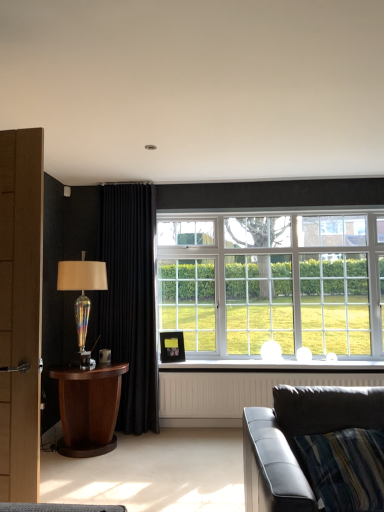
Identify the location of iridescent glass table lamp at left. (82, 298).

You are a GUI agent. You are given a task and a screenshot of the screen. Output one action in this format:
    pyautogui.click(x=<x>, y=<y>)
    Task: Click on the wooden table at left
    This screenshot has height=512, width=384.
    Given the screenshot: What is the action you would take?
    pyautogui.click(x=88, y=408)

From the picture: Measure the distance between wooden table at left and camera.

The distance of wooden table at left from camera is 10.58 feet.

The image size is (384, 512). What do you see at coordinates (130, 298) in the screenshot?
I see `black velvet curtain at left` at bounding box center [130, 298].

This screenshot has width=384, height=512. Identify the location of black velvet curtain at left. (130, 298).

Where is `white glass window at center`? white glass window at center is located at coordinates (273, 283).

Where is `white glossy window sill at lower center`? The image size is (384, 512). white glossy window sill at lower center is located at coordinates (277, 366).

From the image's perspective, is white textured radiator at lower center located above or below wooden table at left?

From the image's perspective, white textured radiator at lower center appears below wooden table at left.

From a real-world perspective, does white textured radiator at lower center sit lower than wooden table at left?

Correct, in the physical world, white textured radiator at lower center is lower than wooden table at left.

Could you tell me if wooden table at left is turned towards white textured radiator at lower center?

Yes, wooden table at left faces towards white textured radiator at lower center.

This screenshot has width=384, height=512. I want to click on radiator located on the right of wooden table at left, so 236,391.

Is wooden table at left further to the viewer compared to white textured radiator at lower center?

That is False.

In the scene shown: Which of these two, wooden table at left or white textured radiator at lower center, stands shorter?

With less height is white textured radiator at lower center.

Between black velvet curtain at left and iridescent glass table lamp at left, which one has less height?

iridescent glass table lamp at left.

Is the surface of black velvet curtain at left in direct contact with iridescent glass table lamp at left?

They are not placed beside each other.

From a real-world perspective, between black velvet curtain at left and iridescent glass table lamp at left, who is vertically lower?

In real-world perspective, iridescent glass table lamp at left is lower.

Is matte black picture frame at center positioned far away from white glass window at center?

Indeed, matte black picture frame at center is not near white glass window at center.

Does point (175, 348) come behind point (259, 283)?

No, it is not.

From a real-world perspective, is matte black picture frame at center over white glass window at center?

Actually, matte black picture frame at center is physically below white glass window at center in the real world.

From the image's perspective, who appears lower, matte black picture frame at center or white glass window at center?

matte black picture frame at center appears lower in the image.

From a real-world perspective, is iridescent glass table lamp at left positioned under black velvet curtain at left based on gravity?

Correct, in the physical world, iridescent glass table lamp at left is lower than black velvet curtain at left.

Is iridescent glass table lamp at left oriented towards black velvet curtain at left?

No, iridescent glass table lamp at left is not aimed at black velvet curtain at left.

Is black velvet curtain at left located within iridescent glass table lamp at left?

No, iridescent glass table lamp at left does not contain black velvet curtain at left.

Which is closer, (75, 262) or (154, 213)?

The point (75, 262) is closer to the camera.

Looking at their sizes, would you say matte black picture frame at center is wider or thinner than leather couch at lower right?

Considering their sizes, matte black picture frame at center looks slimmer than leather couch at lower right.

From the image's perspective, who appears lower, matte black picture frame at center or leather couch at lower right?

leather couch at lower right appears lower in the image.

Is black velvet curtain at left behind leather couch at lower right?

Yes, black velvet curtain at left is behind leather couch at lower right.

From the image's perspective, is black velvet curtain at left located above or below leather couch at lower right?

From the image's perspective, black velvet curtain at left appears above leather couch at lower right.

Is black velvet curtain at left completely or partially outside of leather couch at lower right?

Yes, black velvet curtain at left is outside of leather couch at lower right.

This screenshot has height=512, width=384. Identify the location of table located above the white textured radiator at lower center (from a real-world perspective). (88, 408).

Find the location of `radiator below the wooden table at left (from a real-world perspective)`. radiator below the wooden table at left (from a real-world perspective) is located at coordinates (236, 391).

Based on their spatial positions, is matte black picture frame at center or white glossy window sill at lower center closer to black velvet curtain at left?

Among the two, matte black picture frame at center is located nearer to black velvet curtain at left.

Based on their spatial positions, is leather couch at lower right or white glass window at center closer to matte black picture frame at center?

The object closer to matte black picture frame at center is white glass window at center.

From the picture: When comparing their distances from iridescent glass table lamp at left, does black velvet curtain at left or white glass window at center seem closer?

black velvet curtain at left is closer to iridescent glass table lamp at left.

Based on their spatial positions, is black velvet curtain at left or wooden table at left further from matte black picture frame at center?

Based on the image, wooden table at left appears to be further to matte black picture frame at center.

In the scene shown: Considering their positions, is matte black picture frame at center positioned further to wooden table at left than white glossy window sill at lower center?

white glossy window sill at lower center lies further to wooden table at left than the other object.

Looking at the image, which one is located closer to white glass window at center, black velvet curtain at left or wooden table at left?

Based on the image, black velvet curtain at left appears to be nearer to white glass window at center.

Which object lies further to the anchor point matte black picture frame at center, black velvet curtain at left or white glossy window sill at lower center?

Based on the image, black velvet curtain at left appears to be further to matte black picture frame at center.

Estimate the real-world distances between objects in this image. Which object is closer to leather couch at lower right, wooden table at left or matte black picture frame at center?

wooden table at left lies closer to leather couch at lower right than the other object.

Identify the location of picture frame between black velvet curtain at left and white glass window at center. (172, 346).

This screenshot has height=512, width=384. Find the location of `table between iridescent glass table lamp at left and white glass window at center in the horizontal direction`. table between iridescent glass table lamp at left and white glass window at center in the horizontal direction is located at coordinates (88, 408).

The width and height of the screenshot is (384, 512). In order to click on curtain between iridescent glass table lamp at left and white glass window at center from left to right in this screenshot , I will do `click(130, 298)`.

Locate an element on the screen. The width and height of the screenshot is (384, 512). window sill located between black velvet curtain at left and white glass window at center in the left-right direction is located at coordinates (277, 366).